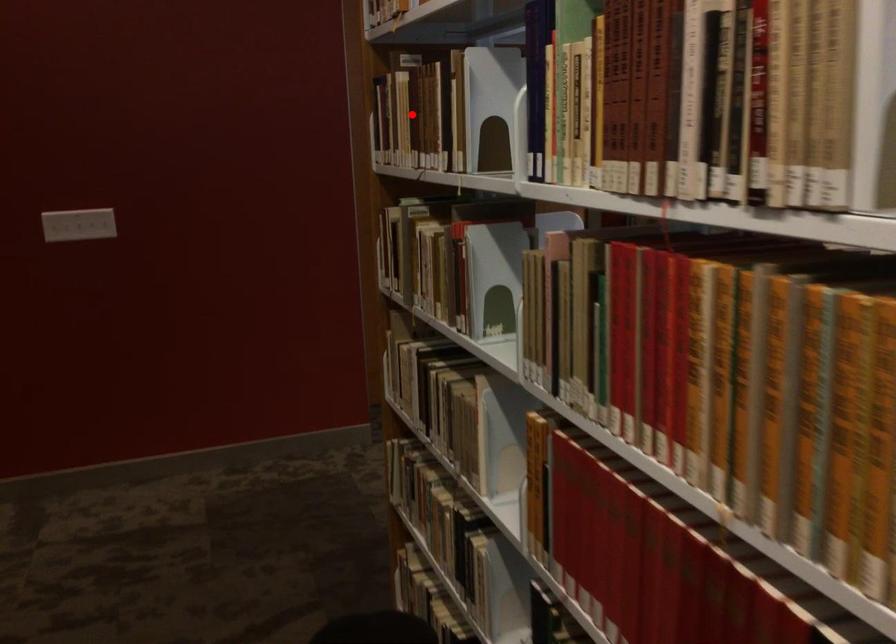
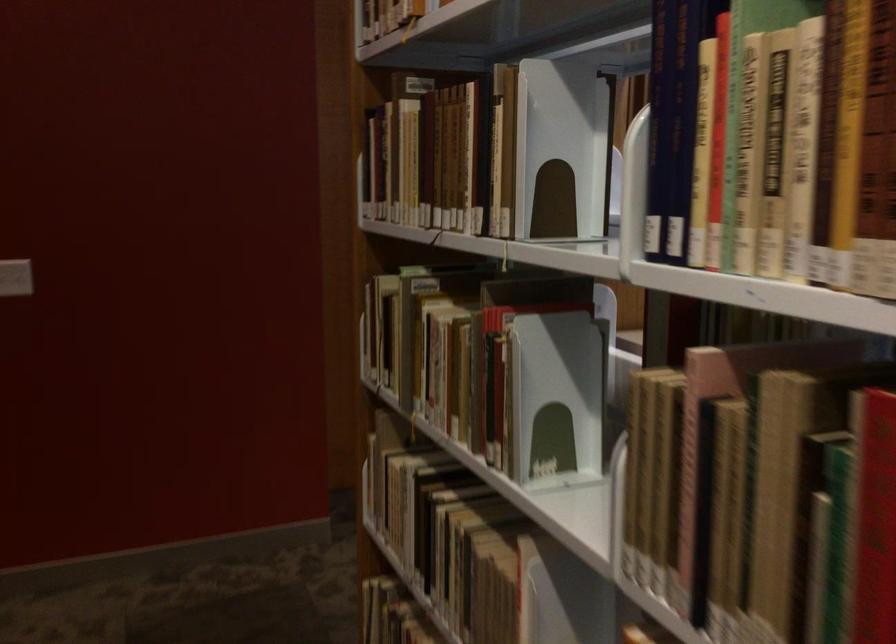
Find the pixel in the second image that matches the highlighted location in the first image.

(425, 158)